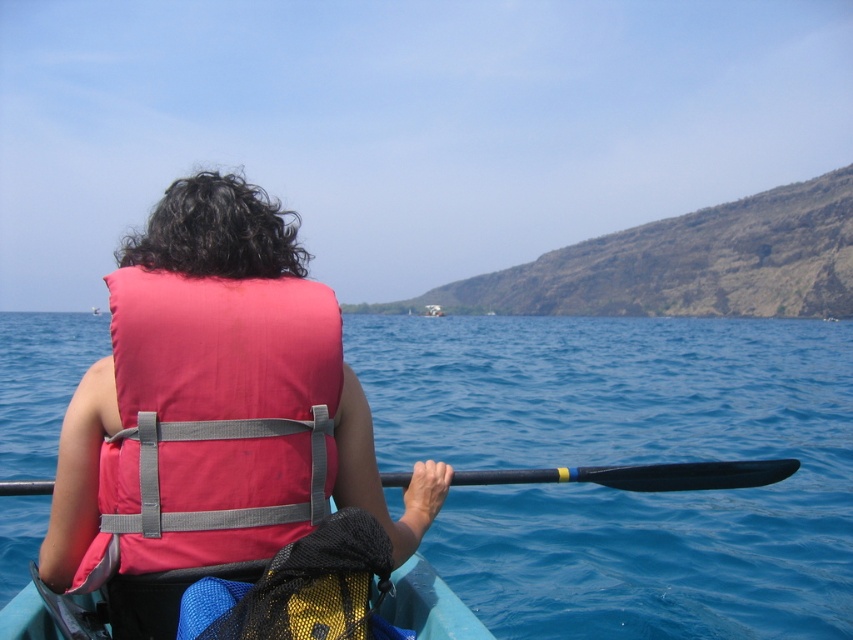
You are a photographer trying to capture the kayaker from the shore. You notice the pink fabric life vest at center and the black rubber paddle at center. Which object appears taller in the photo?

The pink fabric life vest at center appears taller than the black rubber paddle at center in the photo.

What is the exact coordinate of the blue water at center in the image?

The blue water at center is located at point [625,461].

You are a safety inspector checking the kayak setup. The blue water at center and the pink fabric life vest at center are both visible. According to safety guidelines, the life vest must be worn so that it is not submerged under water. Is the current setup compliant with this requirement?

The blue water at center is above the pink fabric life vest at center, meaning the life vest is submerged underwater. This violates safety guidelines as the life vest must not be submerged. The setup is noncompliant.